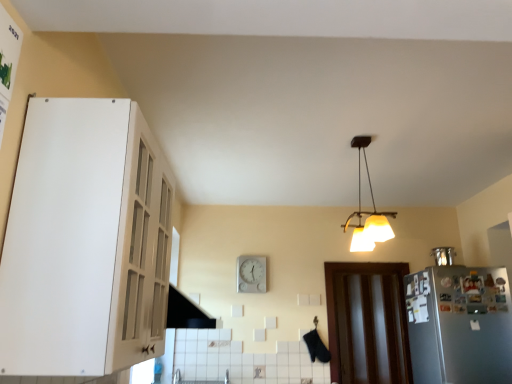
Question: From the image's perspective, does metallic refrigerator at right appear higher than white plastic clock at center?

Choices:
 (A) yes
 (B) no

Answer: (A)

Question: Is metallic refrigerator at right thinner than white plastic clock at center?

Choices:
 (A) no
 (B) yes

Answer: (A)

Question: Is metallic refrigerator at right directly adjacent to white plastic clock at center?

Choices:
 (A) no
 (B) yes

Answer: (A)

Question: Can you confirm if metallic refrigerator at right is wider than white plastic clock at center?

Choices:
 (A) yes
 (B) no

Answer: (A)

Question: From a real-world perspective, is metallic refrigerator at right located higher than white plastic clock at center?

Choices:
 (A) yes
 (B) no

Answer: (A)

Question: Is metallic refrigerator at right smaller than white plastic clock at center?

Choices:
 (A) no
 (B) yes

Answer: (B)

Question: Is metallic refrigerator at right oriented towards satin silver refrigerator at right?

Choices:
 (A) yes
 (B) no

Answer: (B)

Question: Considering the relative sizes of metallic refrigerator at right and satin silver refrigerator at right in the image provided, is metallic refrigerator at right bigger than satin silver refrigerator at right?

Choices:
 (A) no
 (B) yes

Answer: (A)

Question: Can you confirm if metallic refrigerator at right is taller than satin silver refrigerator at right?

Choices:
 (A) no
 (B) yes

Answer: (A)

Question: Is metallic refrigerator at right facing away from satin silver refrigerator at right?

Choices:
 (A) yes
 (B) no

Answer: (B)

Question: Does metallic refrigerator at right have a greater width compared to satin silver refrigerator at right?

Choices:
 (A) yes
 (B) no

Answer: (B)

Question: Is metallic refrigerator at right not within satin silver refrigerator at right?

Choices:
 (A) yes
 (B) no

Answer: (A)

Question: Is metallic refrigerator at right positioned before brown wooden door at lower right?

Choices:
 (A) yes
 (B) no

Answer: (A)